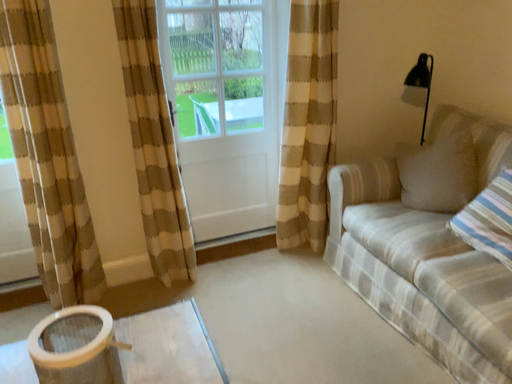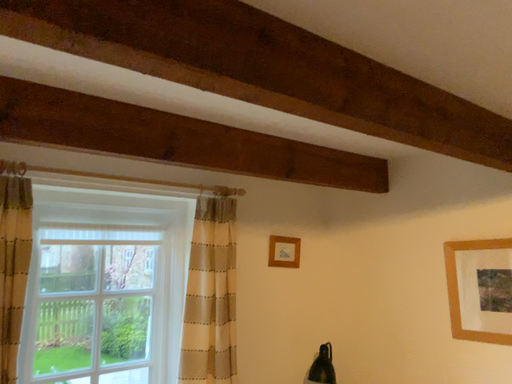
Question: How did the camera likely rotate when shooting the video?

Choices:
 (A) rotated upward
 (B) rotated downward

Answer: (A)